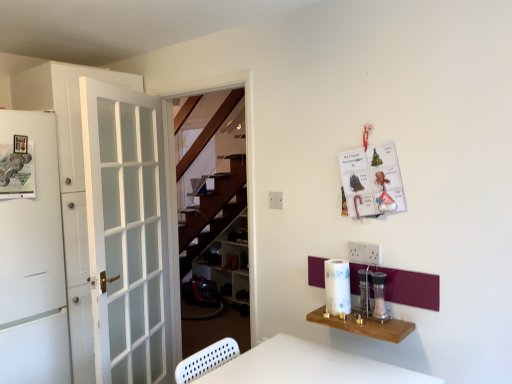
Question: Does wooden shelves at center lie in front of white glass door at left, positioned as the 2th door in front-to-back order?

Choices:
 (A) no
 (B) yes

Answer: (A)

Question: Considering the relative positions of wooden shelves at center and white glass door at left, positioned as the 2th door in front-to-back order, in the image provided, is wooden shelves at center to the right of white glass door at left, positioned as the 2th door in front-to-back order, from the viewer's perspective?

Choices:
 (A) yes
 (B) no

Answer: (A)

Question: Is wooden shelves at center turned away from white glass door at left, the 1th door in the back-to-front sequence?

Choices:
 (A) yes
 (B) no

Answer: (B)

Question: Could you tell me if wooden shelves at center is turned towards white glass door at left, positioned as the 2th door in front-to-back order?

Choices:
 (A) yes
 (B) no

Answer: (A)

Question: Does wooden shelves at center appear on the left side of white glass door at left, the 1th door in the back-to-front sequence?

Choices:
 (A) yes
 (B) no

Answer: (B)

Question: Is wooden shelves at center next to white glass door at left, positioned as the 2th door in front-to-back order?

Choices:
 (A) yes
 (B) no

Answer: (B)

Question: Can you confirm if clear glass salt and pepper shakers at right, the second appliance in the left-to-right sequence, is thinner than wooden shelves at center?

Choices:
 (A) no
 (B) yes

Answer: (B)

Question: Does clear glass salt and pepper shakers at right, placed as the 1th appliance when sorted from right to left, have a greater width compared to wooden shelves at center?

Choices:
 (A) no
 (B) yes

Answer: (A)

Question: From a real-world perspective, does clear glass salt and pepper shakers at right, placed as the 1th appliance when sorted from right to left, sit lower than wooden shelves at center?

Choices:
 (A) no
 (B) yes

Answer: (A)

Question: Is clear glass salt and pepper shakers at right, placed as the 1th appliance when sorted from right to left, positioned with its back to wooden shelves at center?

Choices:
 (A) no
 (B) yes

Answer: (A)

Question: Does clear glass salt and pepper shakers at right, placed as the 1th appliance when sorted from right to left, have a smaller size compared to wooden shelves at center?

Choices:
 (A) yes
 (B) no

Answer: (A)

Question: Is clear glass salt and pepper shakers at right, the second appliance in the left-to-right sequence, outside wooden shelves at center?

Choices:
 (A) no
 (B) yes

Answer: (B)

Question: Does metallic silver salt and pepper shakers at center right, which appears as the 2th appliance when viewed from the right, have a larger size compared to white glass door at left, positioned as the 2th door in front-to-back order?

Choices:
 (A) no
 (B) yes

Answer: (A)